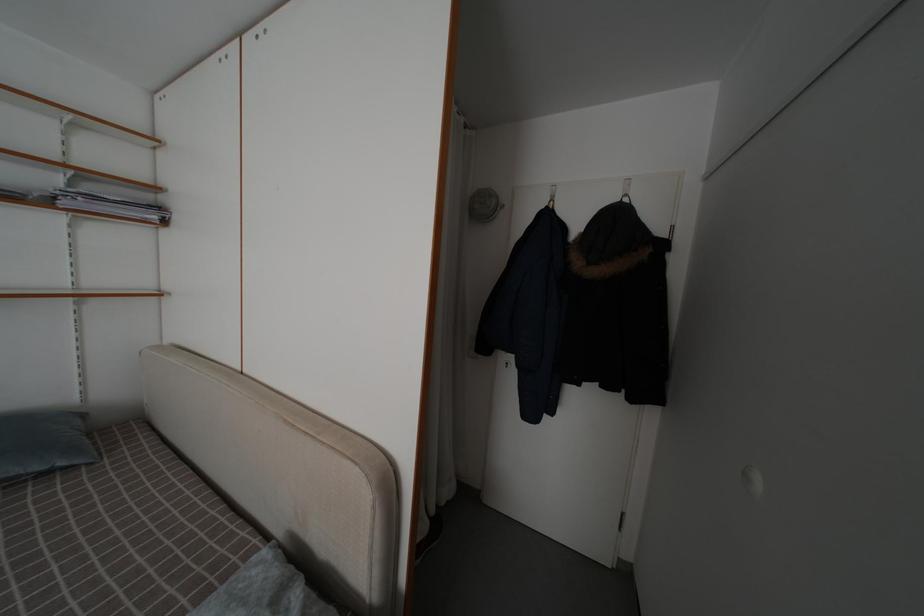
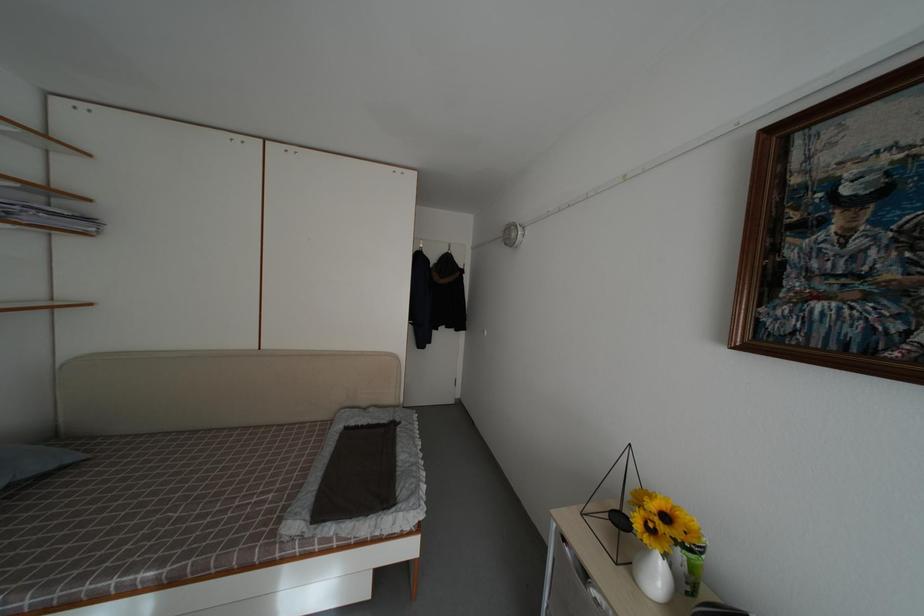
The point at (165, 215) is marked in the first image. Where is the corresponding point in the second image?

(94, 225)